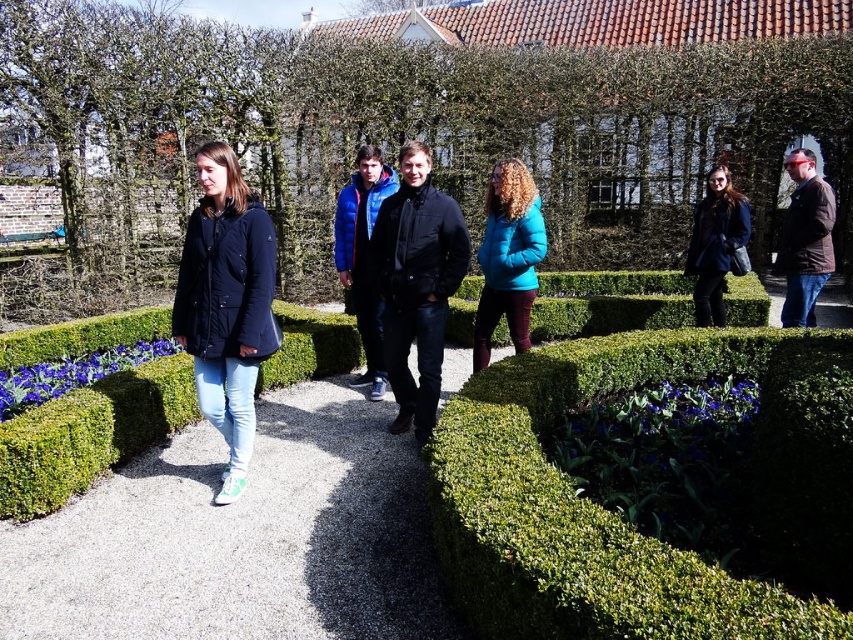
You are standing at the point marked as point (624, 520) in the garden scene. What is the nearest object to you?

The nearest object to you is the green leafy hedge at center, as the point (624, 520) is located on it.

You are standing in the garden and want to take a photo of the two points marked in the scene. Which point, point (505, 200) or point (718, 310), will appear larger in your camera view?

Point (505, 200) will appear larger in the camera view because it is closer to the camera than point (718, 310).